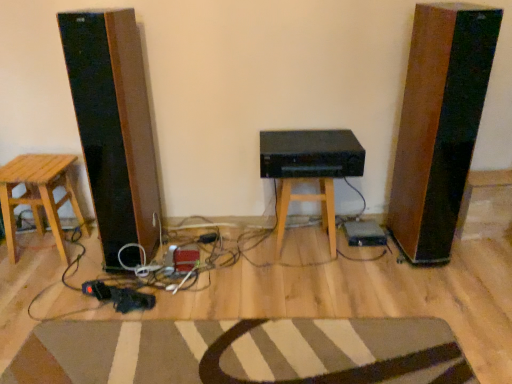
You are a GUI agent. You are given a task and a screenshot of the screen. Output one action in this format:
    pyautogui.click(x=<x>, y=<y>)
    Task: Click on the vacant area that is situated to the right of wooden stool at center, the second stool when ordered from left to right
    The height and width of the screenshot is (384, 512).
    Given the screenshot: What is the action you would take?
    pyautogui.click(x=356, y=253)